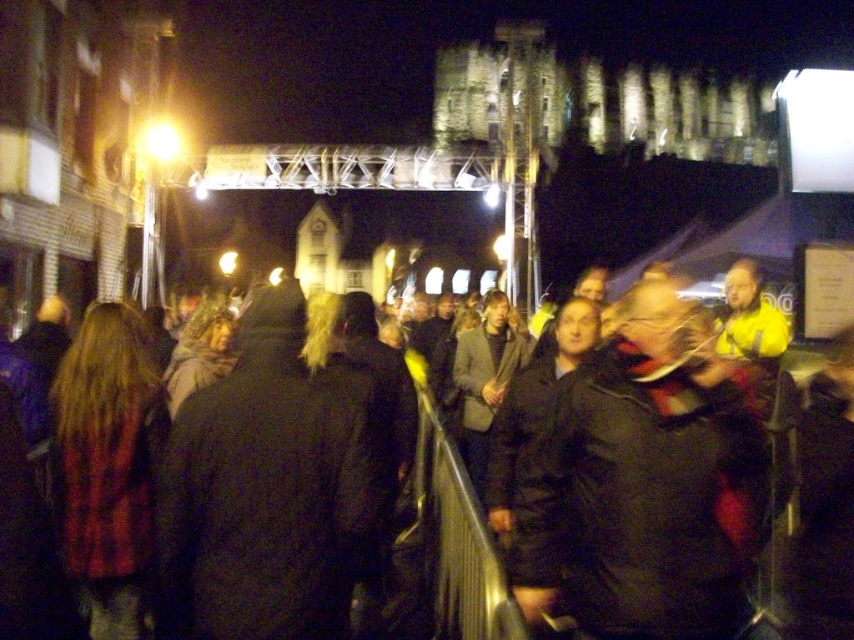
Which of these two, dark gray jacket at center or dark wool coat at center, stands shorter?

Standing shorter between the two is dark gray jacket at center.

Does point (603, 477) come behind point (626, 483)?

That is True.

Does point (619, 572) lie in front of point (557, 451)?

Yes.

Where is `dark gray jacket at center`? dark gray jacket at center is located at coordinates (647, 481).